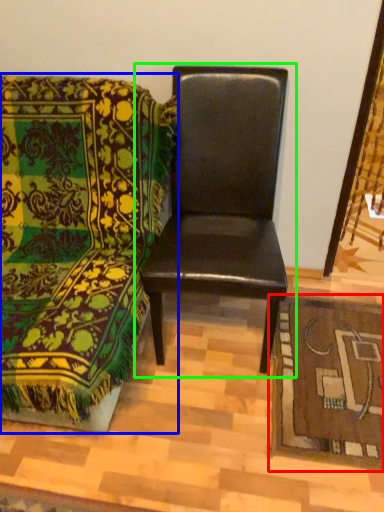
Question: Based on their relative distances, which object is farther from mat (highlighted by a red box)? Choose from chair (highlighted by a blue box) and chair (highlighted by a green box).

Choices:
 (A) chair
 (B) chair

Answer: (A)